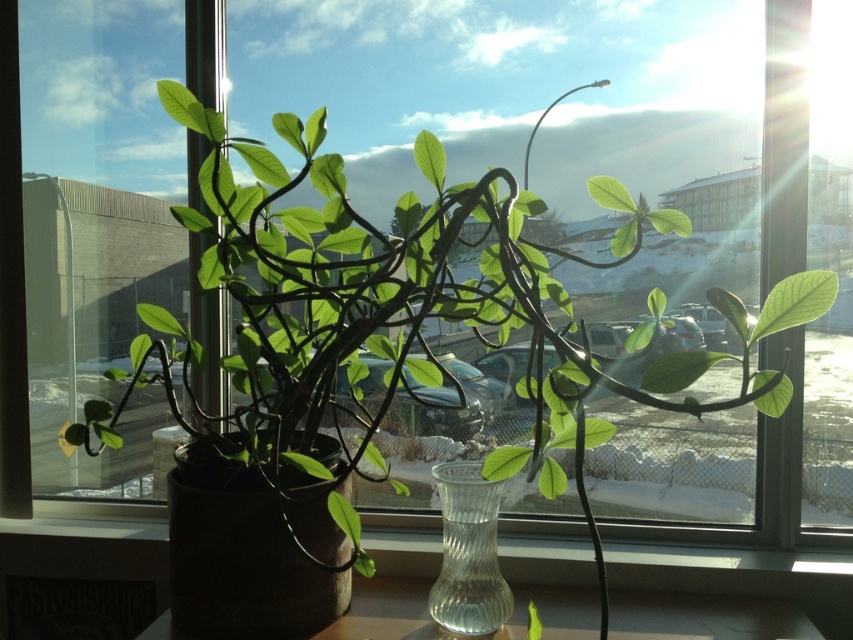
You are a florist arranging flowers for a client. You have two vases, the transparent glass vase at center and the clear glass vase at center, and need to place them side by side on a shelf that is 25 centimeters wide. Will both vases fit on the shelf without overlapping?

The transparent glass vase at center and the clear glass vase at center are 23.82 centimeters apart from each other. Since the shelf is 25 centimeters wide, there is enough space to place both vases side by side without overlapping.